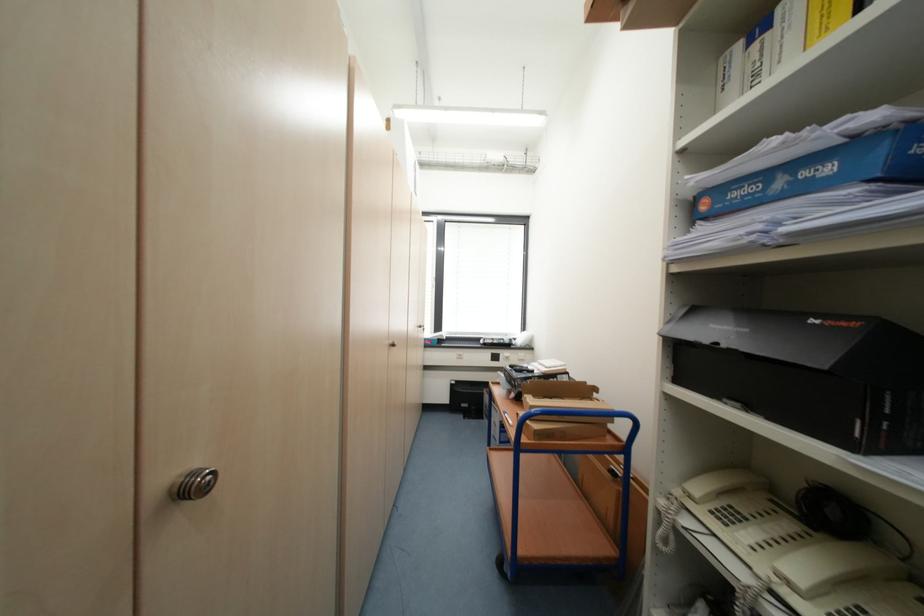
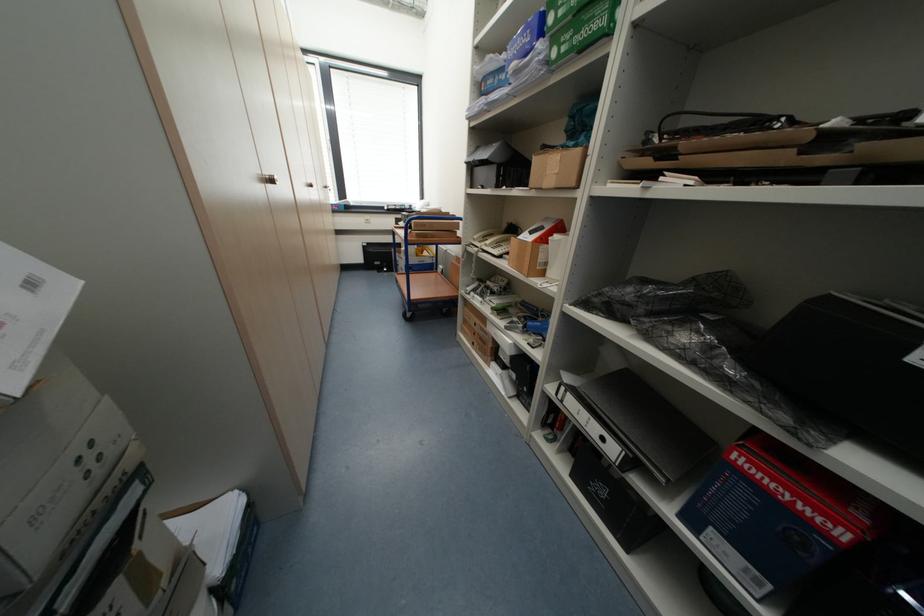
Locate, in the second image, the point that corresponds to point 197,491 in the first image.

(278, 182)